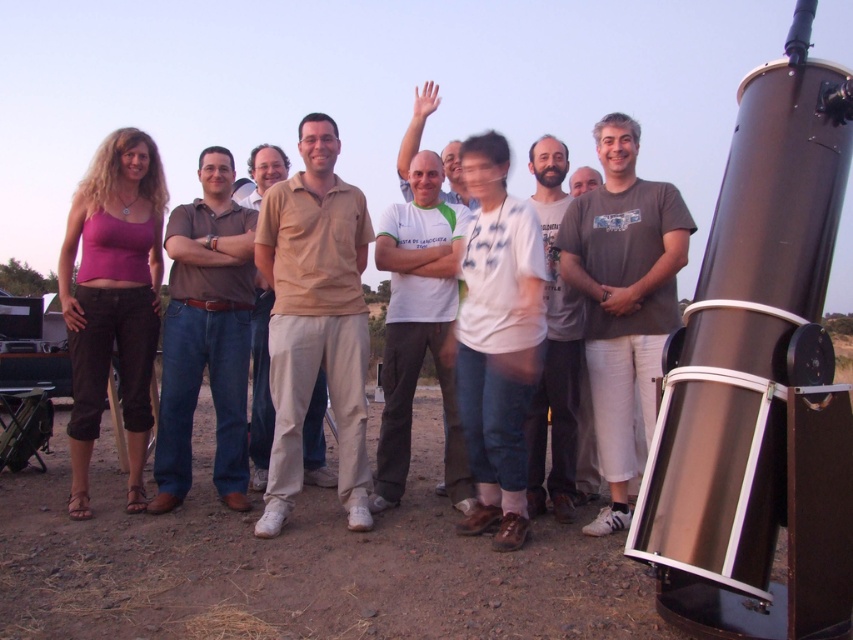
Question: Which point is closer to the camera?

Choices:
 (A) beige cotton shirt at center
 (B) dirt field at lower center
 (C) brown denim jeans at center

Answer: (B)

Question: Which point appears farthest from the camera in this image?

Choices:
 (A) (317, 344)
 (B) (553, 474)

Answer: (B)

Question: Is beige cotton polo shirt at center thinner than gray cotton t-shirt at center?

Choices:
 (A) yes
 (B) no

Answer: (B)

Question: Considering the relative positions of gray cotton t-shirt at center and white cotton t-shirt at center in the image provided, where is gray cotton t-shirt at center located with respect to white cotton t-shirt at center?

Choices:
 (A) right
 (B) left

Answer: (A)

Question: Is brown denim jeans at center to the left of beige cotton shirt at center from the viewer's perspective?

Choices:
 (A) yes
 (B) no

Answer: (A)

Question: Which point appears closest to the camera in this image?

Choices:
 (A) (310, 264)
 (B) (543, 460)

Answer: (A)